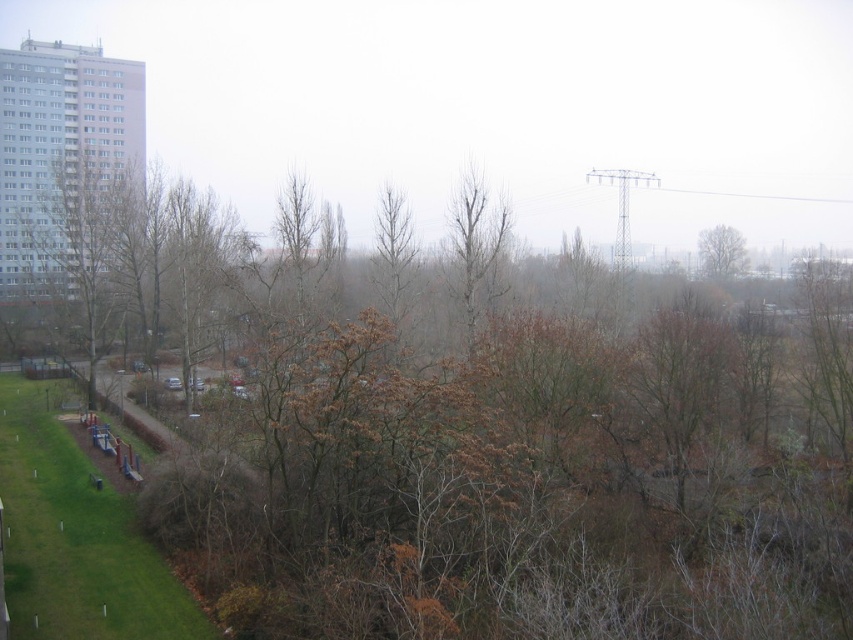
You are standing in the urban landscape scene. You see a brown leafless tree at left and a brown leafless tree at upper right. Which tree is positioned higher in the image?

The brown leafless tree at left is positioned higher in the image than the brown leafless tree at upper right according to the description.

You are a city planner analyzing this urban landscape. You need to determine which object occupies more horizontal space between the brown leafless tree at left and the bare branches at center. Which one is wider?

The brown leafless tree at left is wider than the bare branches at center, as its width surpasses that of the latter.

You are a city planner reviewing this urban scene. You need to determine if the brown leafless tree at left has a lower height than the bare branches at center. Based on the information provided, can you confirm this?

The brown leafless tree at left is located above the bare branches at center, which means it is taller than the bare branches at center. Therefore, the brown leafless tree at left is not lower in height compared to the bare branches at center.